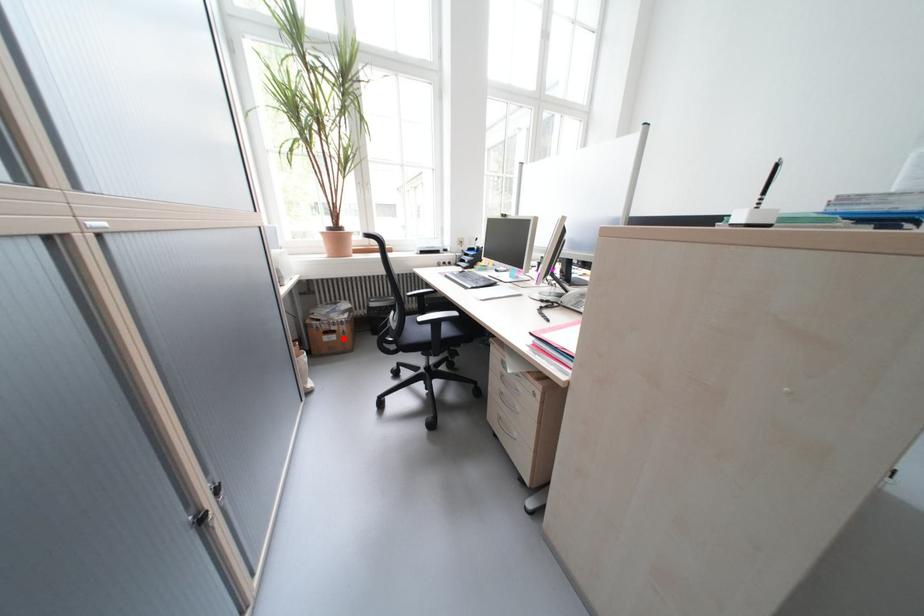
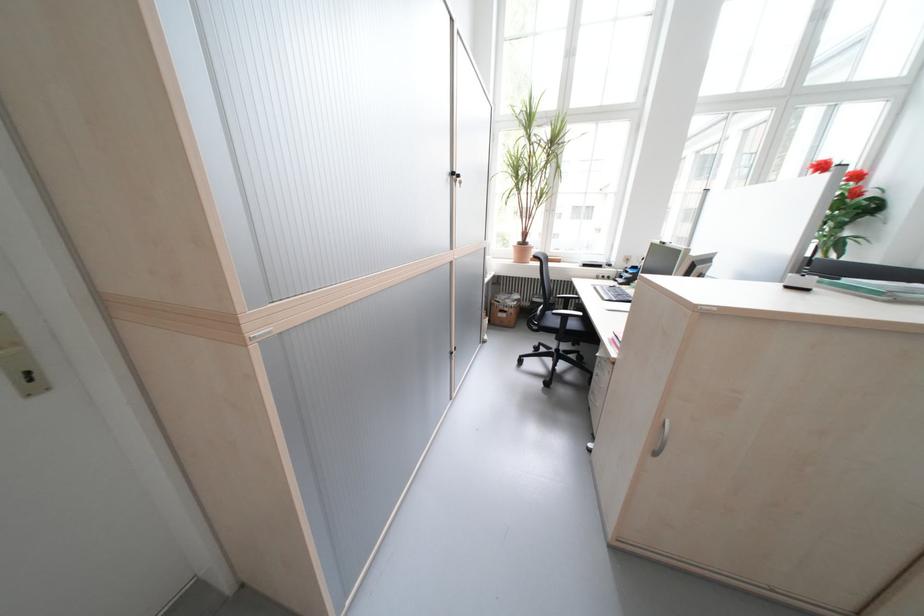
The point at the highlighted location is marked in the first image. Where is the corresponding point in the second image?

(515, 315)